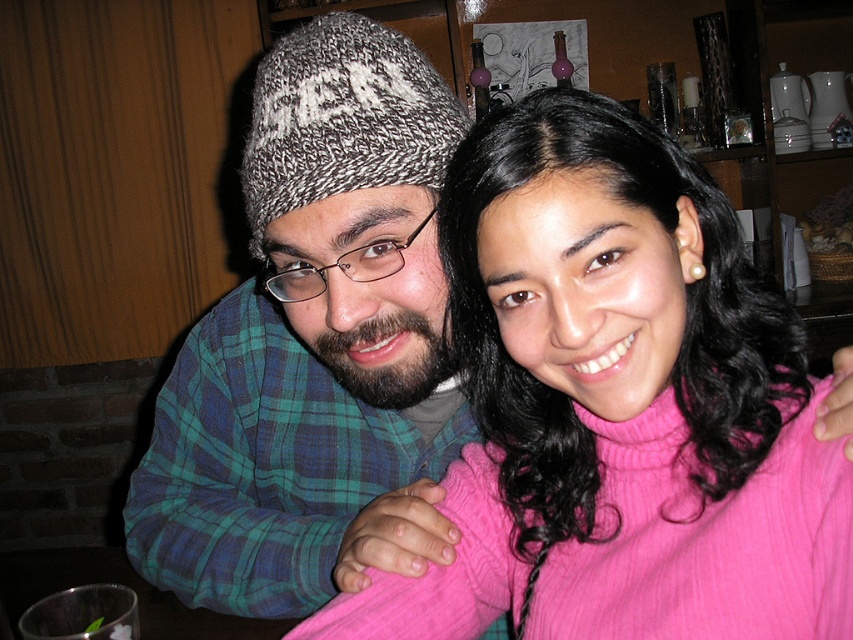
You are a tailor measuring the distance between two hats on a shelf for a display. The hats are the knitted wool beanie at upper left and the knitted gray and white hat at upper left. The display requires a minimum of 10 centimeters between items. Can both hats meet the display requirement?

The knitted wool beanie at upper left and the knitted gray and white hat at upper left are 10.27 centimeters apart, which exceeds the minimum requirement of 10 centimeters. Therefore, both hats meet the display requirement.

You are a tailor who needs to determine which hat requires more fabric to make between the knitted wool beanie at upper left and the knitted gray and white hat at upper left. Based on the image, which one would need more fabric?

The knitted wool beanie at upper left requires more fabric because it has a larger size than the knitted gray and white hat at upper left.